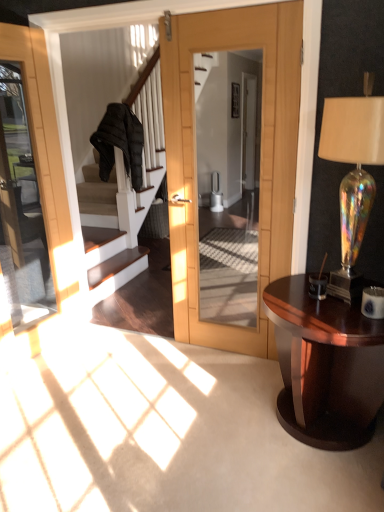
Question: Is glossy wood table at lower right in front of iridescent glass lamp at right?

Choices:
 (A) yes
 (B) no

Answer: (B)

Question: Is glossy wood table at lower right to the left of iridescent glass lamp at right from the viewer's perspective?

Choices:
 (A) no
 (B) yes

Answer: (B)

Question: Is glossy wood table at lower right outside iridescent glass lamp at right?

Choices:
 (A) no
 (B) yes

Answer: (B)

Question: From the image's perspective, is glossy wood table at lower right on iridescent glass lamp at right?

Choices:
 (A) no
 (B) yes

Answer: (A)

Question: Is glossy wood table at lower right bigger than iridescent glass lamp at right?

Choices:
 (A) yes
 (B) no

Answer: (A)

Question: Would you say glossy wood table at lower right is a long distance from iridescent glass lamp at right?

Choices:
 (A) yes
 (B) no

Answer: (B)

Question: Is iridescent glass lamp at right smaller than glossy wood table at lower right?

Choices:
 (A) no
 (B) yes

Answer: (B)

Question: Is iridescent glass lamp at right at the right side of glossy wood table at lower right?

Choices:
 (A) no
 (B) yes

Answer: (B)

Question: Is iridescent glass lamp at right positioned behind glossy wood table at lower right?

Choices:
 (A) yes
 (B) no

Answer: (B)

Question: Would you consider iridescent glass lamp at right to be distant from glossy wood table at lower right?

Choices:
 (A) yes
 (B) no

Answer: (B)

Question: From a real-world perspective, is iridescent glass lamp at right below glossy wood table at lower right?

Choices:
 (A) yes
 (B) no

Answer: (B)

Question: Is iridescent glass lamp at right closer to the viewer compared to glossy wood table at lower right?

Choices:
 (A) no
 (B) yes

Answer: (B)

Question: In the image, is glossy wood table at lower right on the left side or the right side of iridescent glass lamp at right?

Choices:
 (A) right
 (B) left

Answer: (B)